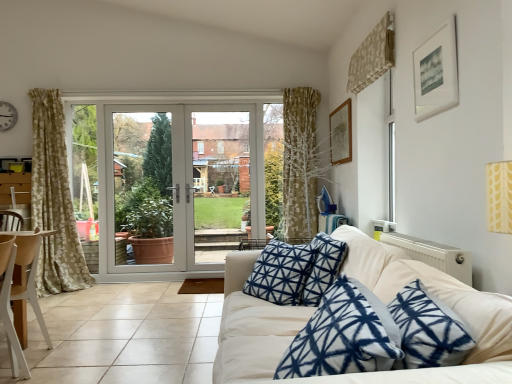
The image size is (512, 384). Identify the location of white plastic screen door at center, positioned as the 2th screen door in left-to-right order. (221, 182).

Find the location of a particular element. This screenshot has width=512, height=384. white glossy door at center is located at coordinates (186, 182).

Where is `beige tile at lower left`? Image resolution: width=512 pixels, height=384 pixels. beige tile at lower left is located at coordinates (123, 336).

This screenshot has height=384, width=512. Identify the location of the 2nd screen door positioned above the white fabric couch at center (from the image's perspective). (221, 182).

Which of these two, white fabric couch at center or white plastic screen door at center, the first screen door positioned from the right, is wider?

white fabric couch at center is wider.

Is the surface of white fabric couch at center in direct contact with white plastic screen door at center, the first screen door positioned from the right?

white fabric couch at center and white plastic screen door at center, the first screen door positioned from the right, are not in contact.

What's the angular difference between white fabric couch at center and white plastic screen door at center, positioned as the 2th screen door in left-to-right order,'s facing directions?

89 degrees.

Would you say wooden chair at left is outside white fabric couch at center?

Yes, wooden chair at left is located beyond the bounds of white fabric couch at center.

Is wooden chair at left further to the viewer compared to white fabric couch at center?

Yes, the depth of wooden chair at left is greater than that of white fabric couch at center.

Could you tell me if wooden chair at left is facing white fabric couch at center?

No, wooden chair at left is not turned towards white fabric couch at center.

Considering the relative sizes of wooden chair at left and white fabric couch at center in the image provided, is wooden chair at left shorter than white fabric couch at center?

Correct, wooden chair at left is not as tall as white fabric couch at center.

Which object is further away from the camera, wooden picture frame at upper right, which appears as the 2th picture frame when viewed from the right, or white glossy door at center?

white glossy door at center.

Which is correct: wooden picture frame at upper right, the first picture frame viewed from the left, is inside white glossy door at center, or outside of it?

wooden picture frame at upper right, the first picture frame viewed from the left, cannot be found inside white glossy door at center.

In the scene shown: Is wooden picture frame at upper right, placed as the second picture frame when sorted from front to back, aimed at white glossy door at center?

Yes, wooden picture frame at upper right, placed as the second picture frame when sorted from front to back, is aimed at white glossy door at center.

Identify the location of door that appears below the wooden picture frame at upper right, placed as the second picture frame when sorted from front to back (from a real-world perspective). point(186,182).

Are wooden picture frame at upper right, placed as the second picture frame when sorted from front to back, and wooden chair at left beside each other?

There is a gap between wooden picture frame at upper right, placed as the second picture frame when sorted from front to back, and wooden chair at left.

From the image's perspective, relative to wooden chair at left, is wooden picture frame at upper right, which appears as the 2th picture frame when viewed from the right, above or below?

From the image's perspective, wooden picture frame at upper right, which appears as the 2th picture frame when viewed from the right, appears above wooden chair at left.

Which object is closer to the camera, wooden picture frame at upper right, the first picture frame viewed from the left, or wooden chair at left?

wooden chair at left is in front.

Which is more to the right, wooden picture frame at upper right, which is the 1th picture frame in back-to-front order, or wooden chair at left?

Positioned to the right is wooden picture frame at upper right, which is the 1th picture frame in back-to-front order.

Can you confirm if white glossy door at center is taller than wooden chair at left?

Correct, white glossy door at center is much taller as wooden chair at left.

Considering the sizes of objects white glossy door at center and wooden chair at left in the image provided, who is smaller, white glossy door at center or wooden chair at left?

Smaller between the two is wooden chair at left.

How many degrees apart are the facing directions of white glossy door at center and wooden chair at left?

The facing directions of white glossy door at center and wooden chair at left are 90.2 degrees apart.

Which is in front, white glossy door at center or wooden chair at left?

wooden chair at left is more forward.

Can you confirm if wooden picture frame at upper right, which is the 1th picture frame in back-to-front order, is wider than white matte picture frame at upper right, the first picture frame positioned from the front?

No, wooden picture frame at upper right, which is the 1th picture frame in back-to-front order, is not wider than white matte picture frame at upper right, the first picture frame positioned from the front.

Is wooden picture frame at upper right, placed as the second picture frame when sorted from front to back, shorter than white matte picture frame at upper right, which appears as the 2th picture frame when viewed from the back?

No, wooden picture frame at upper right, placed as the second picture frame when sorted from front to back, is not shorter than white matte picture frame at upper right, which appears as the 2th picture frame when viewed from the back.

From a real-world perspective, is wooden picture frame at upper right, which appears as the 2th picture frame when viewed from the right, located beneath white matte picture frame at upper right, the 2th picture frame positioned from the left?

Yes.

Who is more distant, white matte picture frame at upper right, which appears as the 2th picture frame when viewed from the back, or white plastic screen door at center, the first screen door positioned from the right?

Positioned behind is white plastic screen door at center, the first screen door positioned from the right.

How many degrees apart are the facing directions of white matte picture frame at upper right, which is counted as the first picture frame, starting from the right, and white plastic screen door at center, the first screen door positioned from the right?

They differ by 89.2 degrees in their facing directions.

Which point is more forward, (423, 78) or (214, 136)?

Positioned in front is point (423, 78).

Is white matte picture frame at upper right, the 2th picture frame positioned from the left, not within white plastic screen door at center, the first screen door positioned from the right?

Yes, white matte picture frame at upper right, the 2th picture frame positioned from the left, is located beyond the bounds of white plastic screen door at center, the first screen door positioned from the right.

This screenshot has height=384, width=512. What are the coordinates of `the 2nd screen door above the white fabric couch at center (from the image's perspective)` in the screenshot? It's located at (221, 182).

This screenshot has height=384, width=512. In order to click on studio couch on the right of wooden chair at left in this screenshot , I will do `click(440, 298)`.

Considering their positions, is metallic wall clock at upper left positioned further to white matte picture frame at upper right, which is counted as the first picture frame, starting from the right, than wooden picture frame at upper right, the first picture frame viewed from the left?

Among the two, metallic wall clock at upper left is located further to white matte picture frame at upper right, which is counted as the first picture frame, starting from the right.

Estimate the real-world distances between objects in this image. Which object is further from metallic wall clock at upper left, beige tile at lower left or white glossy door at center, acting as the second screen door starting from the right?

Among the two, beige tile at lower left is located further to metallic wall clock at upper left.

Which object lies nearer to the anchor point white matte picture frame at upper right, which appears as the 2th picture frame when viewed from the back, wooden chair at left or metallic wall clock at upper left?

Based on the image, wooden chair at left appears to be nearer to white matte picture frame at upper right, which appears as the 2th picture frame when viewed from the back.

Which object lies nearer to the anchor point white glossy door at center, marked as the first screen door in a left-to-right arrangement, wooden chair at left or white matte picture frame at upper right, which appears as the 2th picture frame when viewed from the back?

Based on the image, wooden chair at left appears to be nearer to white glossy door at center, marked as the first screen door in a left-to-right arrangement.

In the scene shown: Looking at the image, which one is located further to metallic wall clock at upper left, white fabric couch at center or wooden picture frame at upper right, placed as the second picture frame when sorted from front to back?

white fabric couch at center is further to metallic wall clock at upper left.

Considering their positions, is wooden picture frame at upper right, placed as the second picture frame when sorted from front to back, positioned further to white glossy door at center, marked as the first screen door in a left-to-right arrangement, than white matte picture frame at upper right, the 2th picture frame positioned from the left?

Based on the image, white matte picture frame at upper right, the 2th picture frame positioned from the left, appears to be further to white glossy door at center, marked as the first screen door in a left-to-right arrangement.

Looking at the image, which one is located closer to wooden chair at left, white glossy door at center, acting as the second screen door starting from the right, or wooden picture frame at upper right, which appears as the 2th picture frame when viewed from the right?

Based on the image, white glossy door at center, acting as the second screen door starting from the right, appears to be nearer to wooden chair at left.

From the image, which object appears to be farther from white matte picture frame at upper right, which is counted as the first picture frame, starting from the right, metallic wall clock at upper left or white glossy door at center, marked as the first screen door in a left-to-right arrangement?

Based on the image, metallic wall clock at upper left appears to be further to white matte picture frame at upper right, which is counted as the first picture frame, starting from the right.

This screenshot has width=512, height=384. Find the location of `door located between white fabric couch at center and white plastic screen door at center, positioned as the 2th screen door in left-to-right order, in the depth direction`. door located between white fabric couch at center and white plastic screen door at center, positioned as the 2th screen door in left-to-right order, in the depth direction is located at coordinates (186, 182).

Identify the location of picture frame between beige tile at lower left and white matte picture frame at upper right, which is counted as the first picture frame, starting from the right. The width and height of the screenshot is (512, 384). (341, 134).

I want to click on tile positioned between white fabric couch at center and white glossy door at center, marked as the first screen door in a left-to-right arrangement, from near to far, so click(123, 336).

Locate an element on the screen. This screenshot has width=512, height=384. chair between beige tile at lower left and white glossy door at center from front to back is located at coordinates (27, 283).